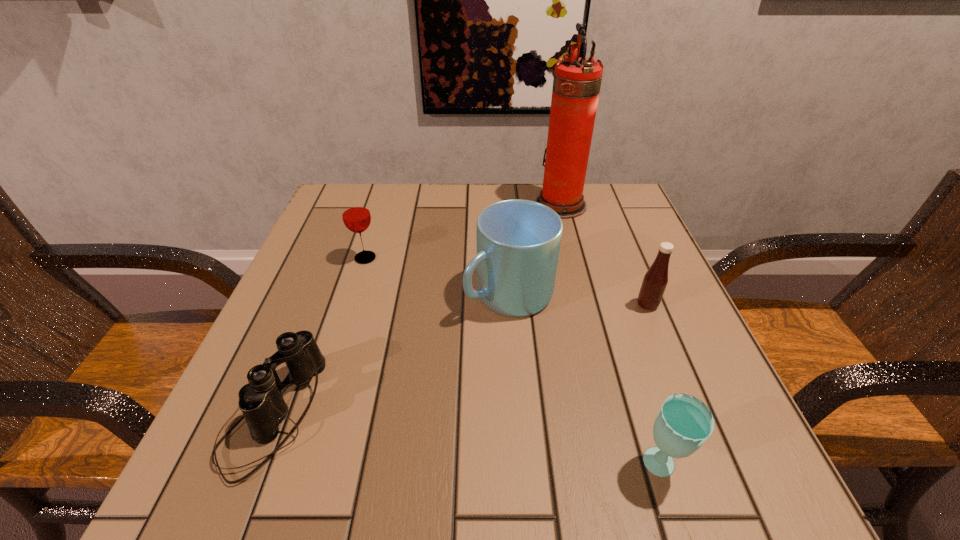
The height and width of the screenshot is (540, 960). I want to click on vacant space situated at the discharge end of the fire extinguisher, so click(x=436, y=205).

At what (x,y) coordinates should I click in order to perform the action: click on blank area located 0.140m on the right of the mug. Please return your answer as a coordinate pair (x, y). This screenshot has width=960, height=540. Looking at the image, I should click on (624, 295).

Locate an element on the screen. Image resolution: width=960 pixels, height=540 pixels. vacant space positioned on the back of the farther glass is located at coordinates (388, 187).

At what (x,y) coordinates should I click in order to perform the action: click on blank space located 0.230m on the left of the Tabasco sauce. Please return your answer as a coordinate pair (x, y). Looking at the image, I should click on tap(516, 305).

Image resolution: width=960 pixels, height=540 pixels. In order to click on free space located on the left of the right glass in this screenshot , I will do `click(371, 467)`.

At what (x,y) coordinates should I click in order to perform the action: click on vacant space located 0.060m on the right of the shortest object. Please return your answer as a coordinate pair (x, y). Looking at the image, I should click on (354, 415).

Where is `object that is at the far edge`? This screenshot has height=540, width=960. object that is at the far edge is located at coordinates (576, 85).

Identify the location of glass located at the near edge. (684, 423).

You are a GUI agent. You are given a task and a screenshot of the screen. Output one action in this format:
    pyautogui.click(x=<x>, y=<y>)
    Task: Click on the binoculars located at the near edge
    This screenshot has width=960, height=540.
    Given the screenshot: What is the action you would take?
    pyautogui.click(x=261, y=402)

The width and height of the screenshot is (960, 540). Identify the location of glass that is at the left edge. click(356, 216).